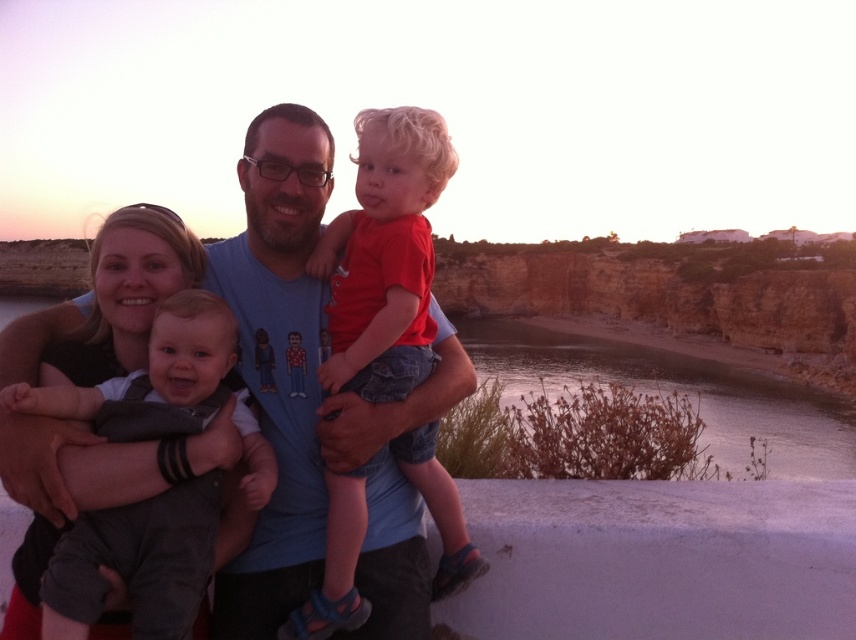
Does point (122, 452) come behind point (76, 410)?

No.

Is blue t-shirt at center to the left of gray cotton onesie at center left from the viewer's perspective?

Incorrect, blue t-shirt at center is not on the left side of gray cotton onesie at center left.

The width and height of the screenshot is (856, 640). What are the coordinates of `blue t-shirt at center` in the screenshot? It's located at (296, 372).

Can you confirm if blue t-shirt at center is smaller than red cotton shirt at center?

No, blue t-shirt at center is not smaller than red cotton shirt at center.

Find the location of `blue t-shirt at center`. blue t-shirt at center is located at coordinates (296, 372).

Does red cotton shirt at center lie behind gray cotton onesie at center left?

That is True.

What do you see at coordinates (385, 257) in the screenshot? I see `red cotton shirt at center` at bounding box center [385, 257].

What are the coordinates of `red cotton shirt at center` in the screenshot? It's located at (385, 257).